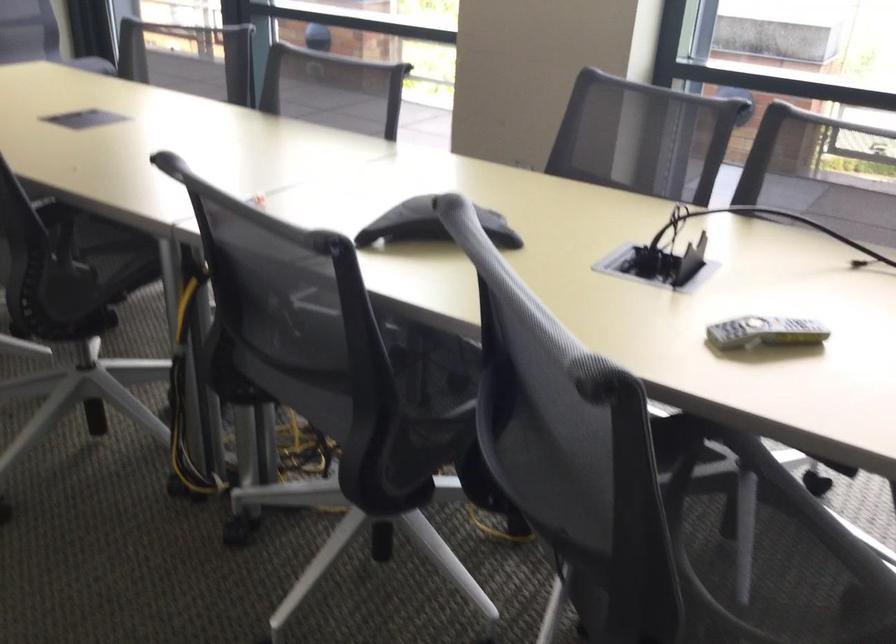
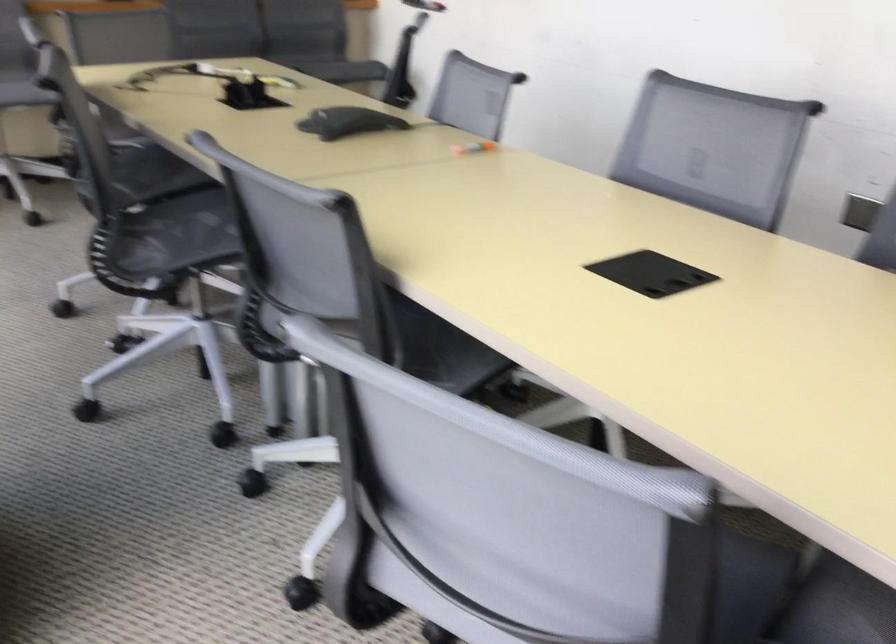
Find the pixel in the second image that matches [231,223] in the first image.

(474, 147)